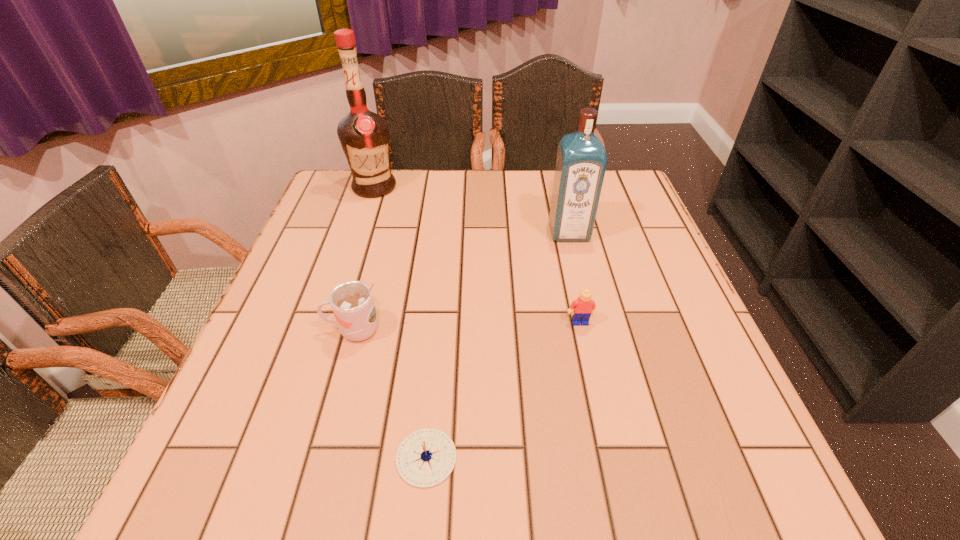
The height and width of the screenshot is (540, 960). What are the coordinates of `vacant space at the far edge` in the screenshot? It's located at (425, 195).

Identify the location of free space at the near edge of the desktop. (663, 489).

You are a GUI agent. You are given a task and a screenshot of the screen. Output one action in this format:
    pyautogui.click(x=<x>, y=<y>)
    Task: Click on the vacant space at the left edge of the desktop
    The width and height of the screenshot is (960, 540).
    Given the screenshot: What is the action you would take?
    pyautogui.click(x=322, y=228)

The image size is (960, 540). Identify the location of free space at the right edge. (593, 232).

This screenshot has height=540, width=960. In the image, there is a desktop. In order to click on vacant space at the far left corner in this screenshot , I will do `click(335, 186)`.

The image size is (960, 540). I want to click on vacant space at the near left corner, so click(x=254, y=492).

This screenshot has width=960, height=540. I want to click on vacant region at the far right corner of the desktop, so click(639, 197).

You are a GUI agent. You are given a task and a screenshot of the screen. Output one action in this format:
    pyautogui.click(x=<x>, y=<y>)
    Task: Click on the free point between the Lego and the farther liquor
    
    Given the screenshot: What is the action you would take?
    pyautogui.click(x=477, y=255)

This screenshot has height=540, width=960. Identify the location of free spot between the second shortest object and the second farthest object. click(574, 277).

The height and width of the screenshot is (540, 960). In order to click on free space between the Lego and the taller liquor in this screenshot , I will do `click(477, 255)`.